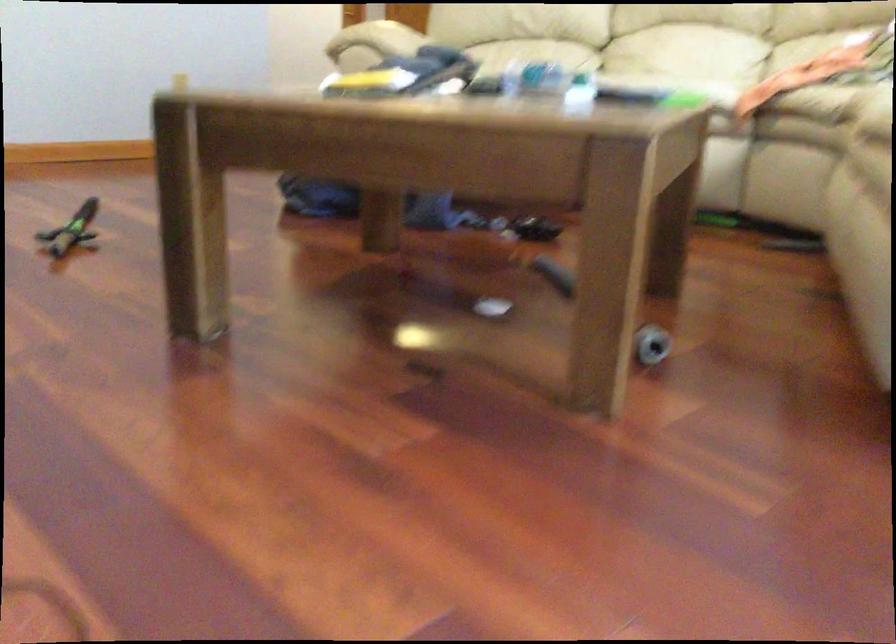
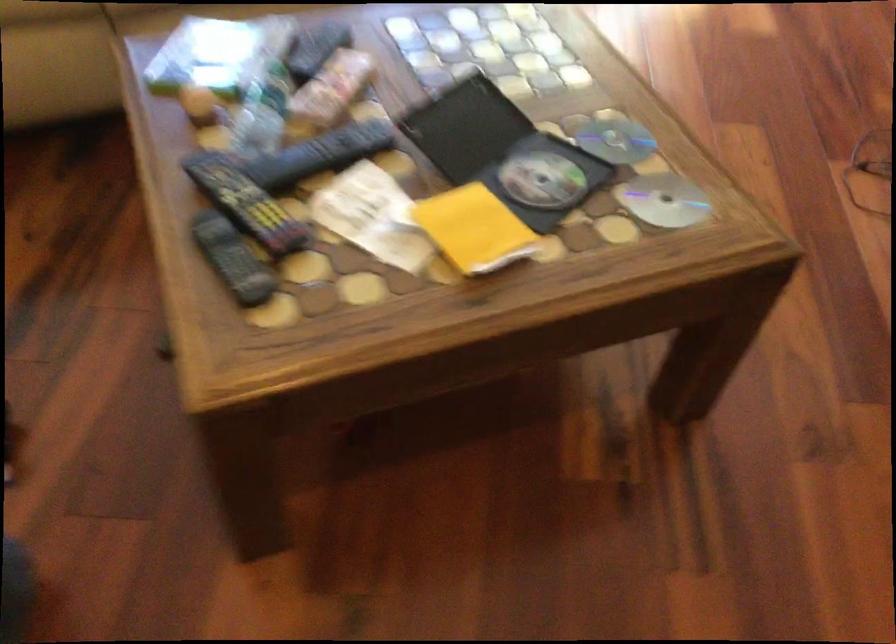
Locate, in the second image, the point that corresponds to pixel 522 71 in the first image.

(262, 113)